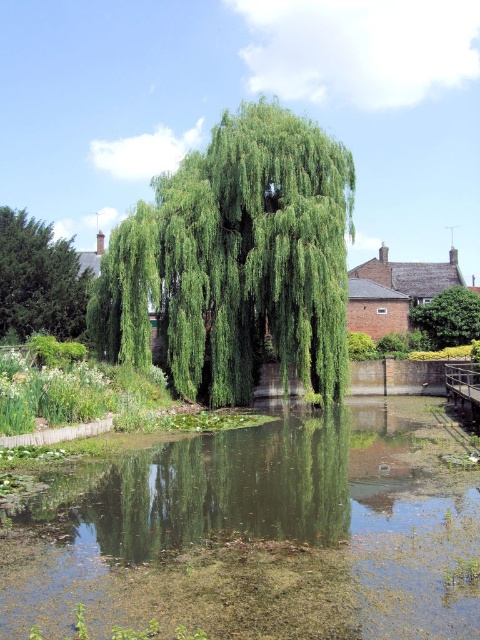
Question: Is green leafy willow at center smaller than green leafy tree at center?

Choices:
 (A) yes
 (B) no

Answer: (B)

Question: Which point is closer to the camera?

Choices:
 (A) green leafy tree at center
 (B) green leafy vegetation at center
 (C) green leafy tree at left
 (D) green leafy willow at center

Answer: (B)

Question: Where is green leafy vegetation at center located in relation to green leafy tree at center in the image?

Choices:
 (A) above
 (B) below

Answer: (B)

Question: Where is green leafy vegetation at center located in relation to green leafy tree at center in the image?

Choices:
 (A) right
 (B) left

Answer: (B)

Question: Which point is farther to the camera?

Choices:
 (A) green leafy willow at center
 (B) green leafy tree at left
 (C) green leafy vegetation at center
 (D) green leafy tree at center

Answer: (D)

Question: Which object is closer to the camera taking this photo?

Choices:
 (A) green leafy tree at center
 (B) green leafy vegetation at center
 (C) green leafy willow at center
 (D) green leafy tree at left

Answer: (B)